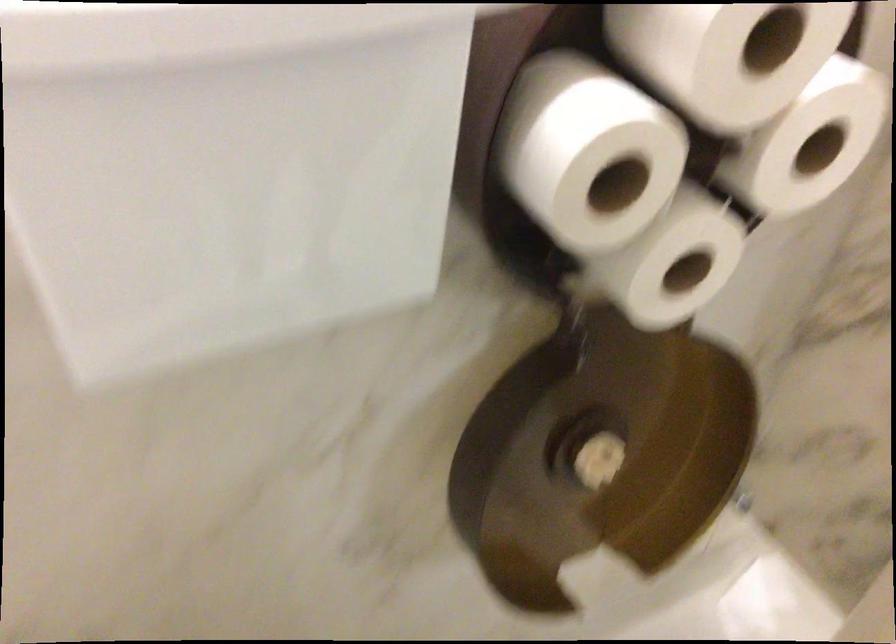
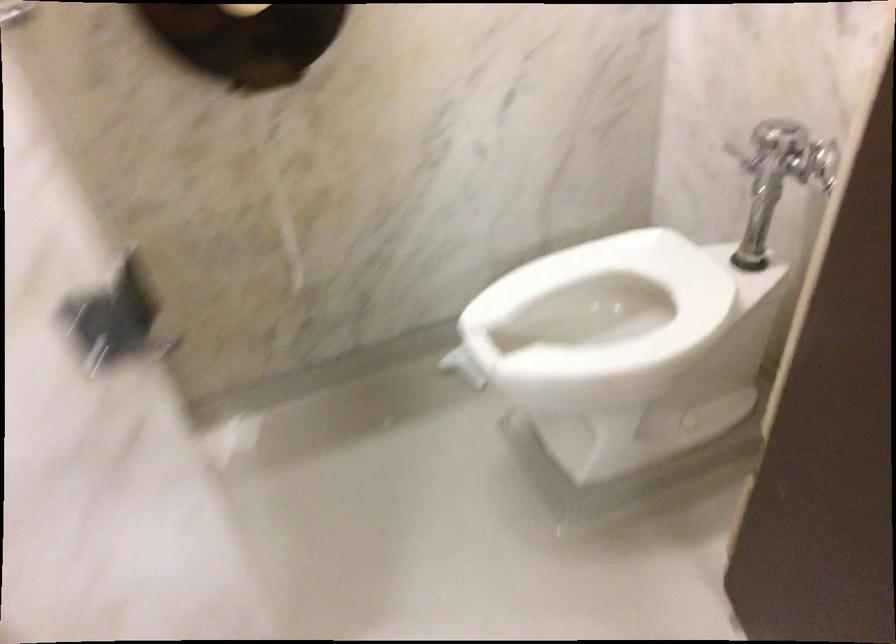
Question: In a continuous first-person perspective shot, in which direction is the camera moving?

Choices:
 (A) Left
 (B) Right
 (C) Forward
 (D) Backward

Answer: (B)